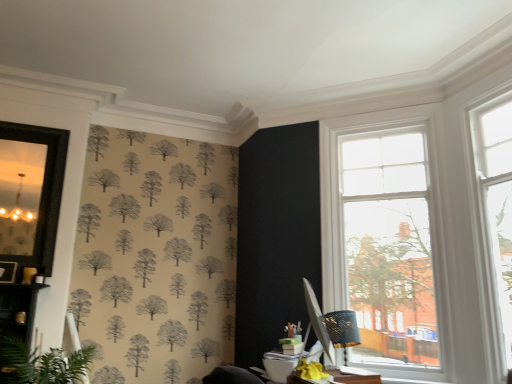
Question: Does clear glass window at upper right, the first window in the right-to-left sequence, have a greater width compared to clear glass window at upper right, placed as the second window when sorted from right to left?

Choices:
 (A) no
 (B) yes

Answer: (A)

Question: Is clear glass window at upper right, which ranks as the 2th window in left-to-right order, positioned behind clear glass window at upper right, placed as the second window when sorted from right to left?

Choices:
 (A) yes
 (B) no

Answer: (B)

Question: Considering the relative sizes of clear glass window at upper right, which ranks as the 2th window in left-to-right order, and clear glass window at upper right, which is the 1th window in left-to-right order, in the image provided, is clear glass window at upper right, which ranks as the 2th window in left-to-right order, smaller than clear glass window at upper right, which is the 1th window in left-to-right order,?

Choices:
 (A) yes
 (B) no

Answer: (A)

Question: From a real-world perspective, does clear glass window at upper right, the first window in the right-to-left sequence, stand above clear glass window at upper right, which is the 1th window in left-to-right order?

Choices:
 (A) yes
 (B) no

Answer: (A)

Question: Can you confirm if clear glass window at upper right, which ranks as the 2th window in left-to-right order, is positioned to the right of clear glass window at upper right, placed as the second window when sorted from right to left?

Choices:
 (A) yes
 (B) no

Answer: (A)

Question: Is clear glass window at upper right, which ranks as the 2th window in left-to-right order, closer to the viewer compared to clear glass window at upper right, which is the 1th window in left-to-right order?

Choices:
 (A) yes
 (B) no

Answer: (A)

Question: From a real-world perspective, is matte black mirror at left over clear glass window at upper right, which ranks as the 2th window in left-to-right order?

Choices:
 (A) no
 (B) yes

Answer: (B)

Question: Could you tell me if matte black mirror at left is facing clear glass window at upper right, which ranks as the 2th window in left-to-right order?

Choices:
 (A) yes
 (B) no

Answer: (B)

Question: Can you confirm if matte black mirror at left is smaller than clear glass window at upper right, the first window in the right-to-left sequence?

Choices:
 (A) yes
 (B) no

Answer: (A)

Question: Is matte black mirror at left closer to the viewer compared to clear glass window at upper right, the first window in the right-to-left sequence?

Choices:
 (A) no
 (B) yes

Answer: (A)

Question: Can you confirm if matte black mirror at left is shorter than clear glass window at upper right, which ranks as the 2th window in left-to-right order?

Choices:
 (A) yes
 (B) no

Answer: (A)

Question: Is matte black mirror at left facing away from clear glass window at upper right, which ranks as the 2th window in left-to-right order?

Choices:
 (A) no
 (B) yes

Answer: (A)

Question: Considering the relative sizes of clear glass window at upper right, the first window in the right-to-left sequence, and matte black mirror at left in the image provided, is clear glass window at upper right, the first window in the right-to-left sequence, wider than matte black mirror at left?

Choices:
 (A) yes
 (B) no

Answer: (A)